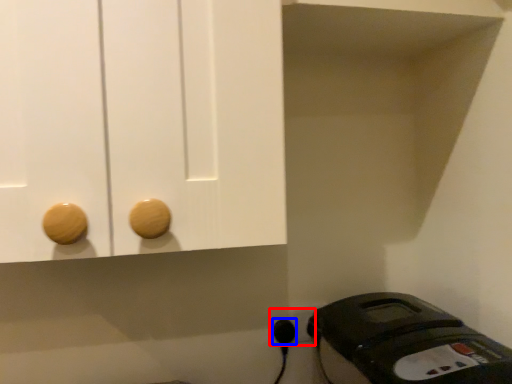
Question: Which object is closer to the camera taking this photo, electric outlet (highlighted by a red box) or plug (highlighted by a blue box)?

Choices:
 (A) electric outlet
 (B) plug

Answer: (B)